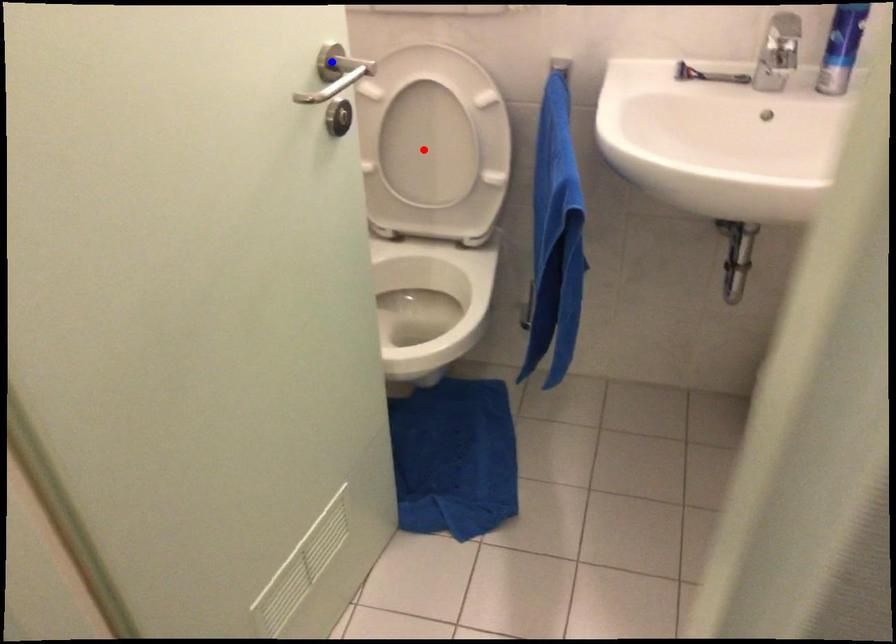
Question: In the image, two points are highlighted. Which point is nearer to the camera? Reply with the corresponding letter.

Choices:
 (A) blue point
 (B) red point

Answer: (A)